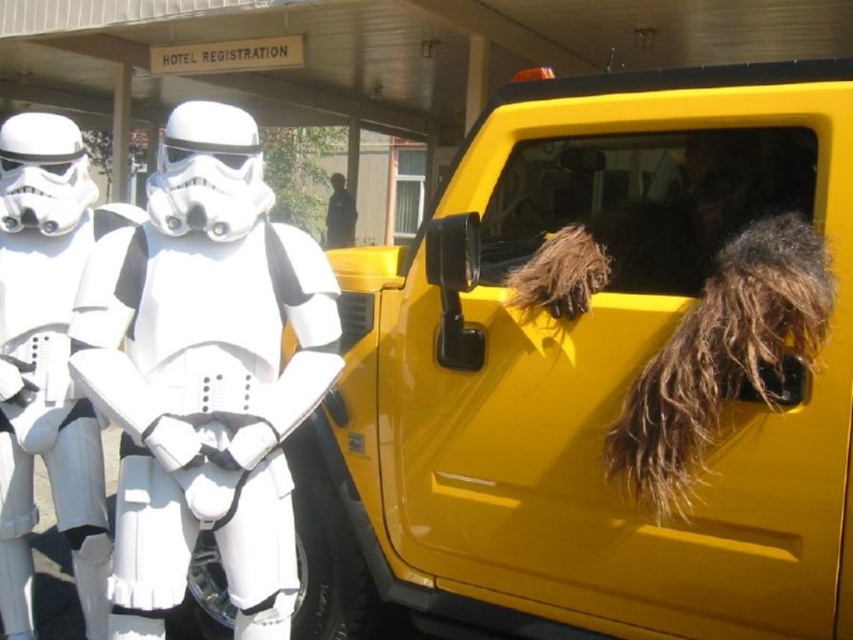
Does yellow matte car at right have a smaller size compared to white plastic stormtrooper at left?

Actually, yellow matte car at right might be larger than white plastic stormtrooper at left.

Can you confirm if yellow matte car at right is positioned to the right of white plastic stormtrooper at left?

Yes, yellow matte car at right is to the right of white plastic stormtrooper at left.

Who is more forward, (744, 460) or (33, 200)?

Point (744, 460) is more forward.

Find the location of `yellow matte car at right`. yellow matte car at right is located at coordinates [x=601, y=372].

Is white matte stormtrooper at center smaller than white plastic stormtrooper at left?

Indeed, white matte stormtrooper at center has a smaller size compared to white plastic stormtrooper at left.

Who is higher up, white matte stormtrooper at center or white plastic stormtrooper at left?

Positioned higher is white matte stormtrooper at center.

Locate an element on the screen. This screenshot has width=853, height=640. white matte stormtrooper at center is located at coordinates (204, 372).

Can you confirm if yellow matte car at right is positioned to the left of white matte stormtrooper at center?

No, yellow matte car at right is not to the left of white matte stormtrooper at center.

Does yellow matte car at right have a greater height compared to white matte stormtrooper at center?

Indeed, yellow matte car at right has a greater height compared to white matte stormtrooper at center.

Is point (566, 451) behind point (270, 273)?

Yes, it is behind point (270, 273).

Where is `yellow matte car at right`? The width and height of the screenshot is (853, 640). yellow matte car at right is located at coordinates (601, 372).